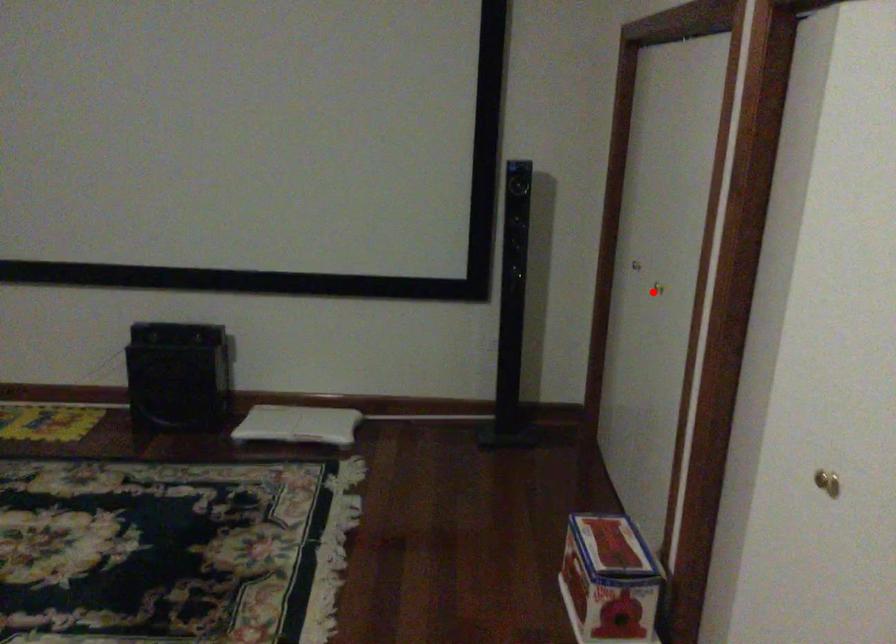
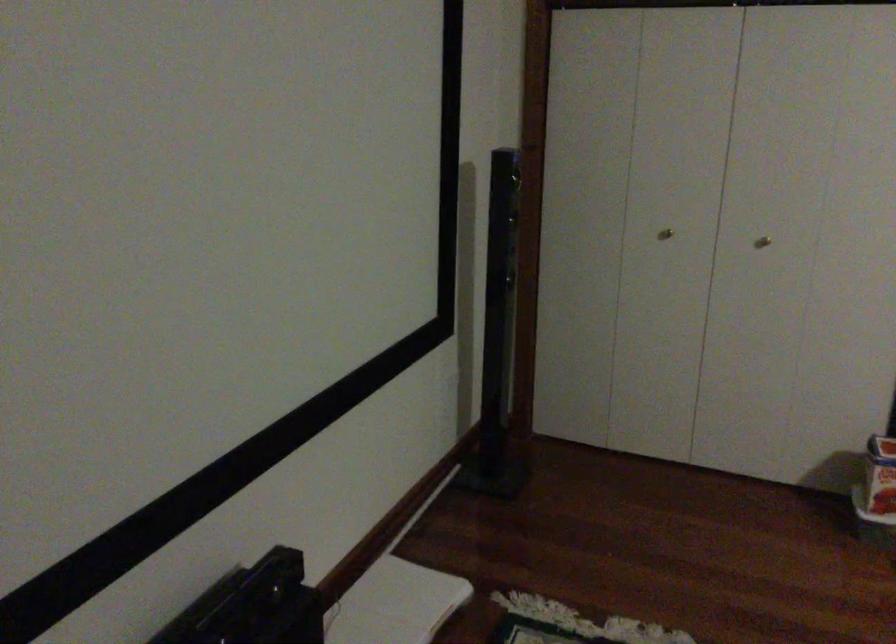
Locate, in the second image, the point that corresponds to the highlighted location in the first image.

(762, 242)